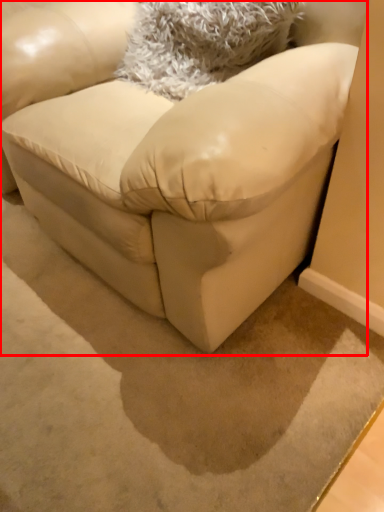
Question: From the image, what is the correct spatial relationship of studio couch (annotated by the red box) in relation to throw pillow?

Choices:
 (A) right
 (B) left

Answer: (B)